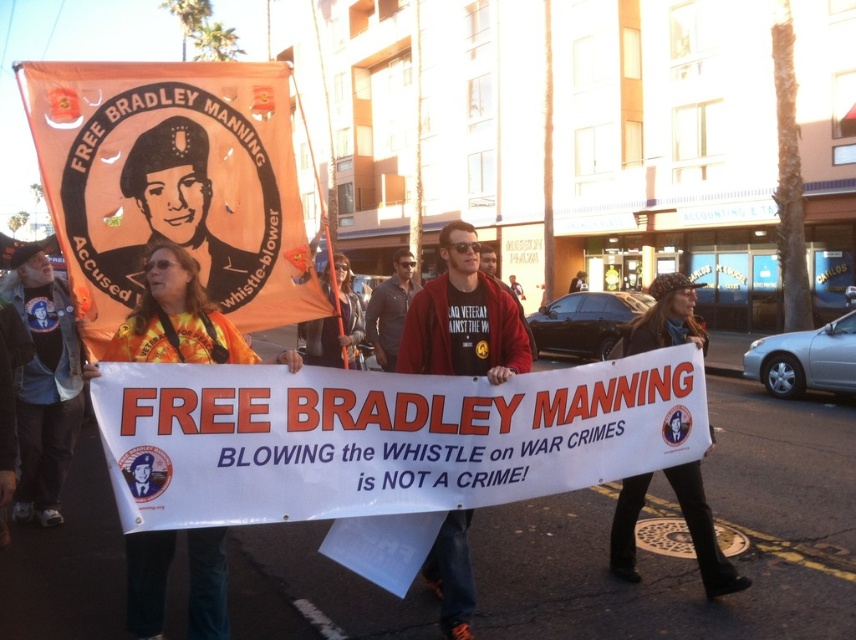
Question: Which is farther from the matte gray shirt at center?

Choices:
 (A) denim jacket at left
 (B) orange fabric banner at upper left

Answer: (A)

Question: Considering the relative positions of orange fabric banner at upper left and matte gray shirt at center in the image provided, where is orange fabric banner at upper left located with respect to matte gray shirt at center?

Choices:
 (A) right
 (B) left

Answer: (B)

Question: Does denim jacket at left have a larger size compared to matte gray shirt at center?

Choices:
 (A) no
 (B) yes

Answer: (B)

Question: Which point appears closest to the camera in this image?

Choices:
 (A) (82, 227)
 (B) (455, 624)
 (C) (36, 472)
 (D) (387, 365)

Answer: (B)

Question: Does red fleece jacket at center lie behind matte gray shirt at center?

Choices:
 (A) yes
 (B) no

Answer: (B)

Question: Which of the following is the closest to the observer?

Choices:
 (A) (385, 326)
 (B) (43, 381)
 (C) (122, 320)

Answer: (C)